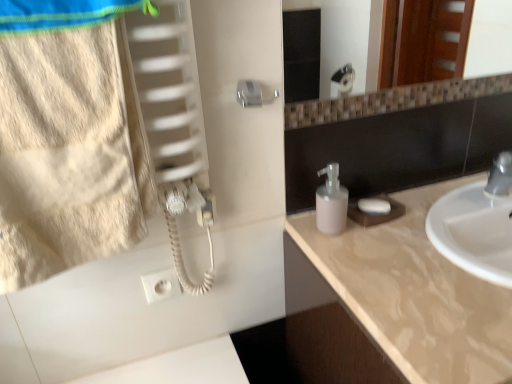
Where is `empty space that is ontop of beige marble countertop at right`? The image size is (512, 384). empty space that is ontop of beige marble countertop at right is located at coordinates (431, 244).